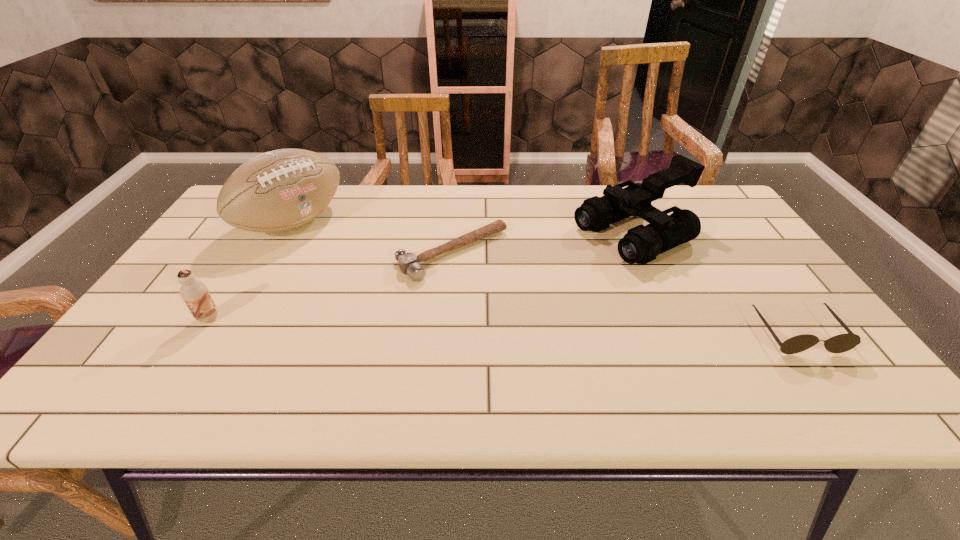
Where is `object situated at the near edge`? object situated at the near edge is located at coordinates (841, 343).

Where is `chocolate milk that is at the left edge`? The image size is (960, 540). chocolate milk that is at the left edge is located at coordinates (195, 294).

Identify the location of football (American) that is at the left edge. tap(280, 190).

Where is `object that is positioned at the right edge`? object that is positioned at the right edge is located at coordinates (841, 343).

Find the location of a particular element. object present at the far left corner is located at coordinates (280, 190).

Locate an element on the screen. The height and width of the screenshot is (540, 960). object that is at the near right corner is located at coordinates (841, 343).

Locate an element on the screen. free point at the far edge is located at coordinates (x=569, y=192).

I want to click on free space at the near edge, so [x=579, y=354].

This screenshot has height=540, width=960. In the image, there is a desktop. What are the coordinates of `vacant space at the right edge` in the screenshot? It's located at (739, 245).

Identify the location of free space at the far right corner of the desktop. Image resolution: width=960 pixels, height=540 pixels. (720, 209).